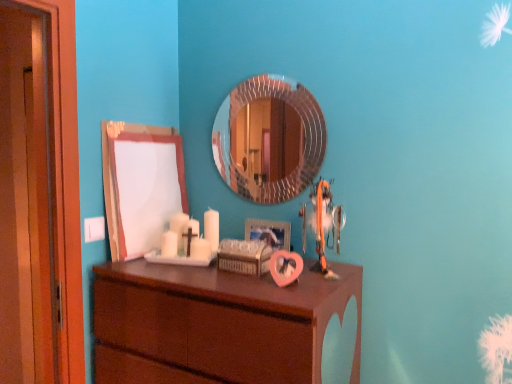
Question: In which direction should I rotate to look at rounded silver mirror at center, the second mirror positioned from the left?

Choices:
 (A) right
 (B) left

Answer: (A)

Question: Does orange fabric toy at center have a greater height compared to brown wood chest of drawers at center?

Choices:
 (A) yes
 (B) no

Answer: (B)

Question: Considering the relative sizes of orange fabric toy at center and brown wood chest of drawers at center in the image provided, is orange fabric toy at center wider than brown wood chest of drawers at center?

Choices:
 (A) no
 (B) yes

Answer: (A)

Question: Is orange fabric toy at center oriented towards brown wood chest of drawers at center?

Choices:
 (A) no
 (B) yes

Answer: (A)

Question: Is orange fabric toy at center located outside brown wood chest of drawers at center?

Choices:
 (A) yes
 (B) no

Answer: (A)

Question: From a real-world perspective, does orange fabric toy at center stand above brown wood chest of drawers at center?

Choices:
 (A) yes
 (B) no

Answer: (A)

Question: Is orange fabric toy at center facing away from brown wood chest of drawers at center?

Choices:
 (A) no
 (B) yes

Answer: (A)

Question: From the image's perspective, is rounded silver mirror at center, the second mirror positioned from the left, on white matte board at upper left, which ranks as the second mirror in right-to-left order?

Choices:
 (A) yes
 (B) no

Answer: (A)

Question: Is rounded silver mirror at center, the second mirror positioned from the left, not within white matte board at upper left, which ranks as the second mirror in right-to-left order?

Choices:
 (A) no
 (B) yes

Answer: (B)

Question: Does rounded silver mirror at center, the second mirror positioned from the left, contain white matte board at upper left, which is the first mirror from left to right?

Choices:
 (A) yes
 (B) no

Answer: (B)

Question: From the image's perspective, is rounded silver mirror at center, the second mirror positioned from the left, located beneath white matte board at upper left, which ranks as the second mirror in right-to-left order?

Choices:
 (A) yes
 (B) no

Answer: (B)

Question: Can you confirm if rounded silver mirror at center, the 1th mirror viewed from the right, is thinner than white matte board at upper left, which is the first mirror from left to right?

Choices:
 (A) yes
 (B) no

Answer: (A)

Question: From a real-world perspective, is rounded silver mirror at center, the 1th mirror viewed from the right, over white matte board at upper left, which is the first mirror from left to right?

Choices:
 (A) yes
 (B) no

Answer: (A)

Question: Can you confirm if rounded silver mirror at center, the second mirror positioned from the left, is taller than orange fabric toy at center?

Choices:
 (A) yes
 (B) no

Answer: (A)